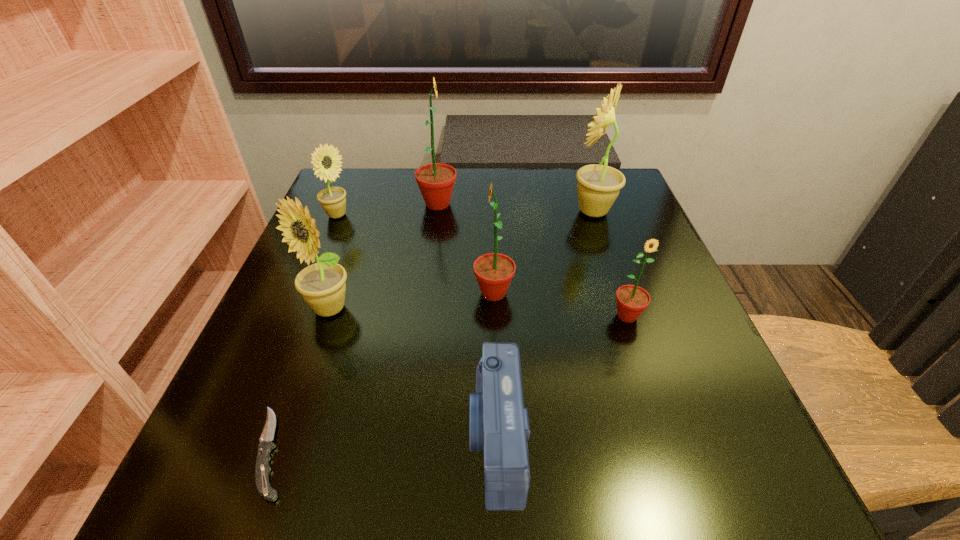
Where is `the rightmost yellow sunflower`? the rightmost yellow sunflower is located at coordinates (598, 186).

Image resolution: width=960 pixels, height=540 pixels. What are the coordinates of `the third sunflower from left to right` in the screenshot? It's located at (436, 181).

This screenshot has height=540, width=960. I want to click on the fifth object from right to left, so point(436,181).

Locate an element on the screen. the second green sunflower from right to left is located at coordinates (494, 272).

What are the coordinates of `the fourth sunflower from left to right` in the screenshot? It's located at [494, 272].

You are a GUI agent. You are given a task and a screenshot of the screen. Output one action in this format:
    pyautogui.click(x=<x>, y=<y>)
    Task: Click on the second biggest yellow sunflower
    This screenshot has height=540, width=960.
    Given the screenshot: What is the action you would take?
    pyautogui.click(x=322, y=285)

Identify the location of the smallest yellow sunflower. The height and width of the screenshot is (540, 960). (332, 199).

Locate an element on the screen. the smallest green sunflower is located at coordinates (632, 300).

The image size is (960, 540). I want to click on the seventh tallest object, so click(499, 425).

The width and height of the screenshot is (960, 540). I want to click on pocketknife, so click(x=262, y=469).